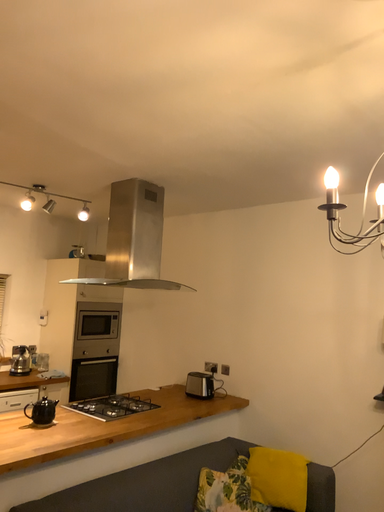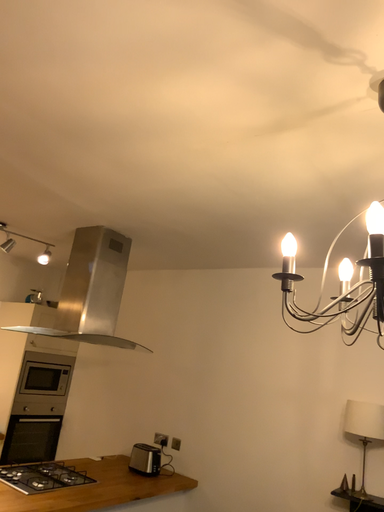
Question: Which way did the camera rotate in the video?

Choices:
 (A) rotated upward
 (B) rotated downward

Answer: (A)